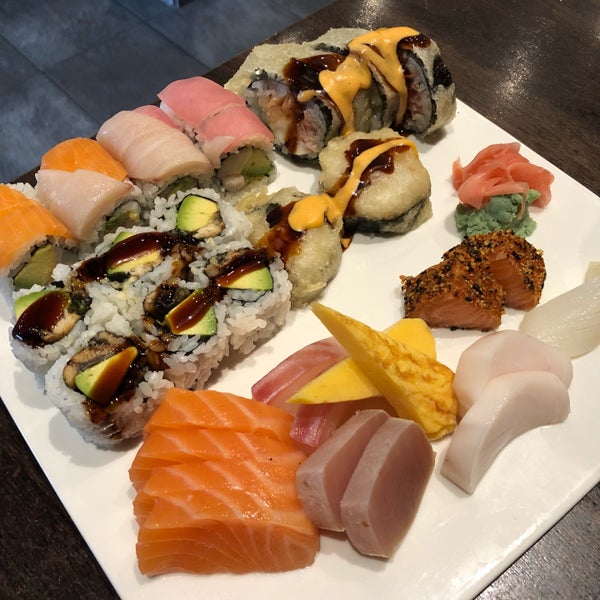
Where is `empty space on table to left of platter`? The image size is (600, 600). empty space on table to left of platter is located at coordinates (18, 512).